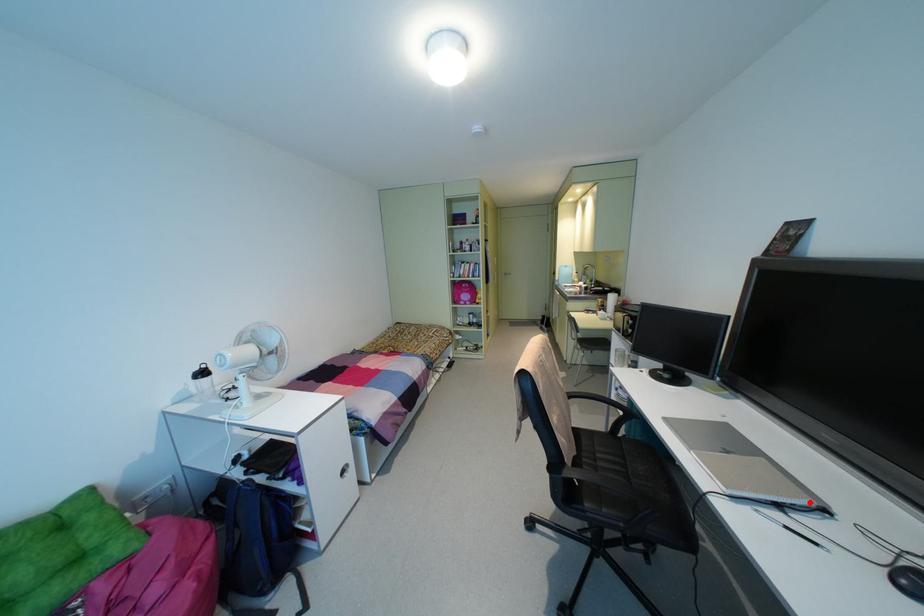
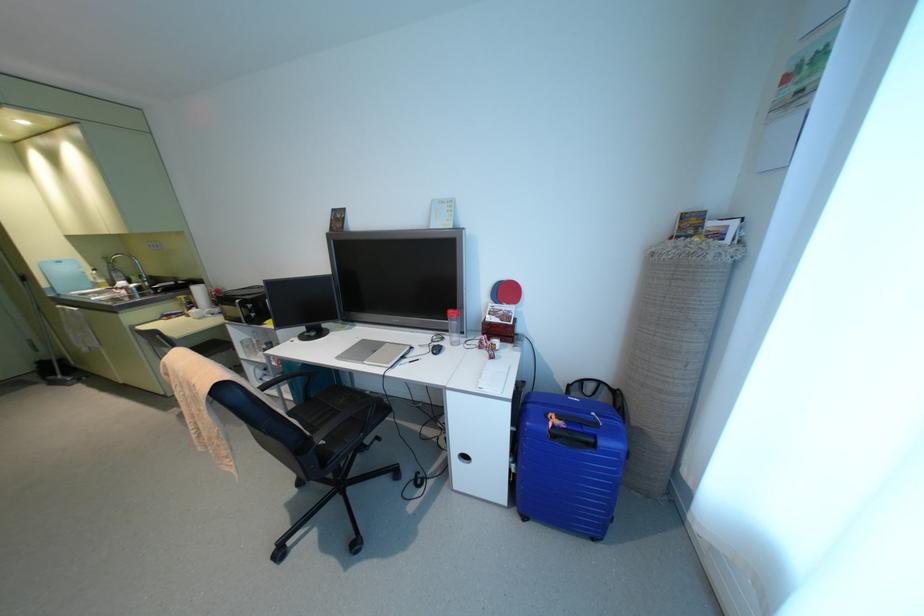
In the second image, find the point that corresponds to the highlighted location in the first image.

(407, 347)